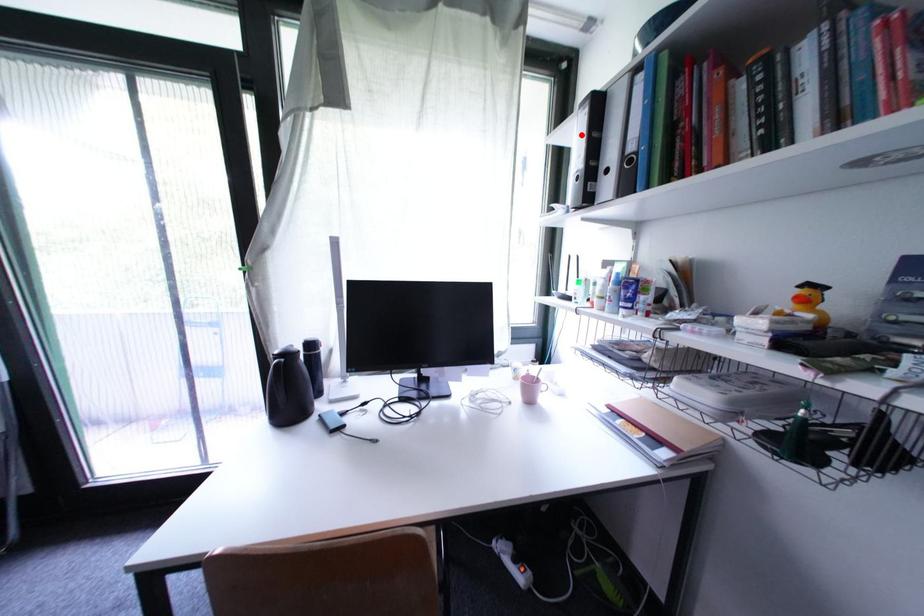
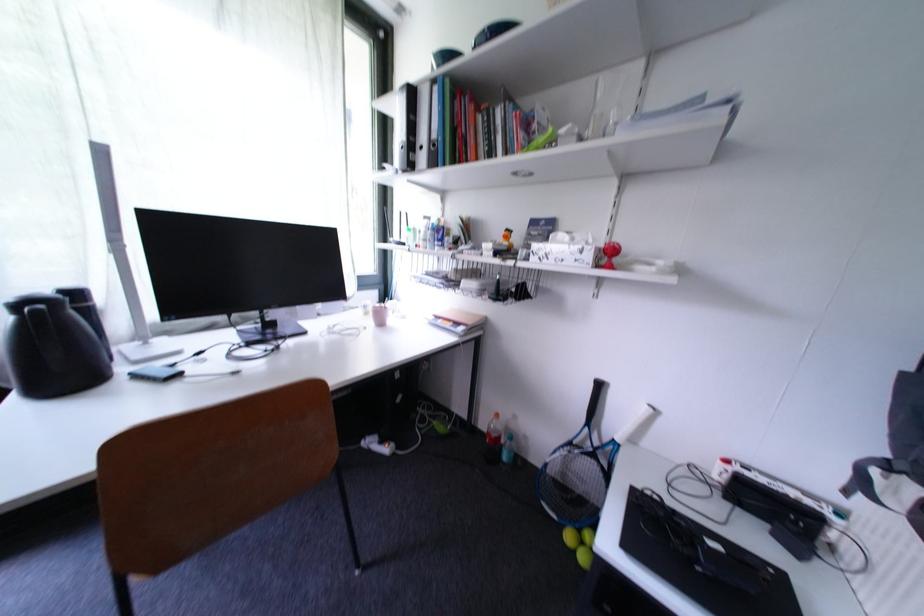
Locate, in the second image, the point that corresponds to the highlighted location in the first image.

(405, 110)